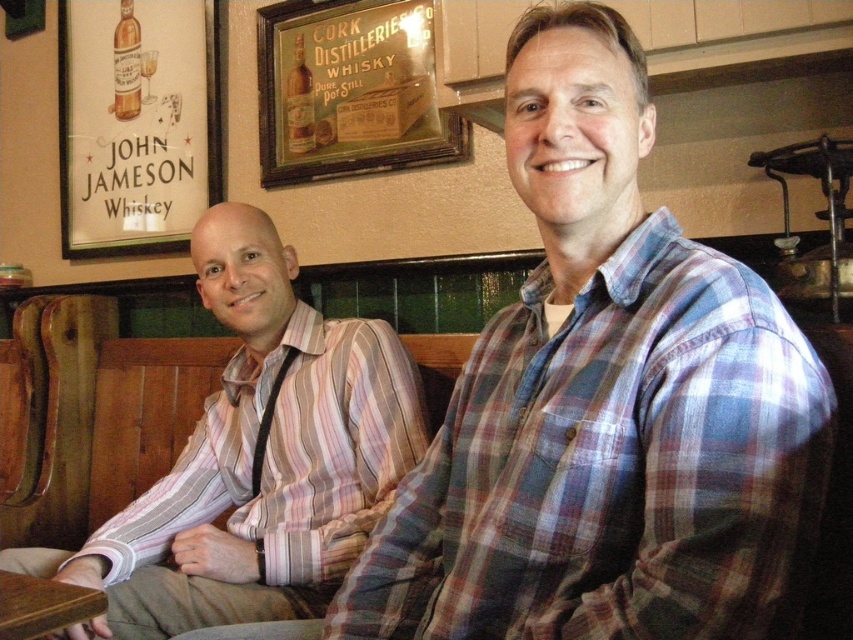
Question: Which point is farther to the camera?

Choices:
 (A) (404, 532)
 (B) (289, 374)

Answer: (B)

Question: Can you confirm if plaid cotton shirt at center is positioned above pink striped shirt at left?

Choices:
 (A) no
 (B) yes

Answer: (B)

Question: Is plaid cotton shirt at center thinner than pink striped shirt at left?

Choices:
 (A) yes
 (B) no

Answer: (A)

Question: Does plaid cotton shirt at center have a greater width compared to brown wooden table at lower left?

Choices:
 (A) no
 (B) yes

Answer: (B)

Question: Estimate the real-world distances between objects in this image. Which object is closer to the brown wooden table at lower left?

Choices:
 (A) plaid cotton shirt at center
 (B) pink striped shirt at left

Answer: (B)

Question: Which point is closer to the camera taking this photo?

Choices:
 (A) [x=630, y=339]
 (B) [x=90, y=636]
 (C) [x=227, y=237]

Answer: (A)